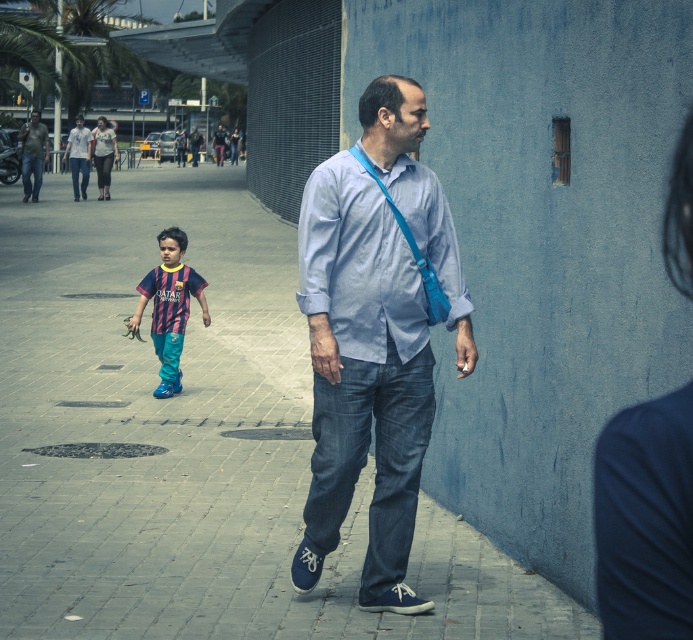
Question: Estimate the real-world distances between objects in this image. Which object is closer to the matte green shirt at upper left?

Choices:
 (A) matte blue shirt at center
 (B) light blue cotton shirt at center

Answer: (A)

Question: Can you confirm if light blue cotton shirt at center is positioned below matte blue shirt at center?

Choices:
 (A) no
 (B) yes

Answer: (B)

Question: Is matte blue pants at center behind matte blue shirt at center?

Choices:
 (A) no
 (B) yes

Answer: (A)

Question: In this image, where is blue denim jeans at center located relative to matte blue shirt at center?

Choices:
 (A) left
 (B) right

Answer: (B)

Question: Which of the following is the farthest from the observer?

Choices:
 (A) matte green shirt at upper left
 (B) matte blue shirt at center

Answer: (B)

Question: Among these points, which one is nearest to the camera?

Choices:
 (A) (407, 320)
 (B) (35, 147)

Answer: (A)